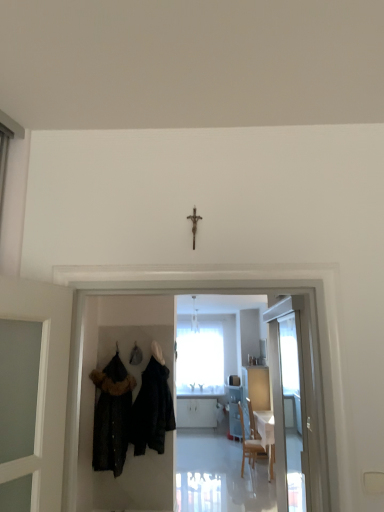
Question: Is white glossy door at right to the right of velvet black coat at left, arranged as the second fancy dress when viewed from the right, from the viewer's perspective?

Choices:
 (A) no
 (B) yes

Answer: (B)

Question: Does white glossy door at right have a smaller size compared to velvet black coat at left, which is counted as the 1th fancy dress, starting from the left?

Choices:
 (A) no
 (B) yes

Answer: (B)

Question: Is white glossy door at right located outside velvet black coat at left, which is counted as the 1th fancy dress, starting from the left?

Choices:
 (A) yes
 (B) no

Answer: (A)

Question: Is velvet black coat at left, arranged as the second fancy dress when viewed from the right, surrounded by white glossy door at right?

Choices:
 (A) yes
 (B) no

Answer: (B)

Question: Considering the relative sizes of white glossy door at right and velvet black coat at left, which is counted as the 1th fancy dress, starting from the left, in the image provided, is white glossy door at right shorter than velvet black coat at left, which is counted as the 1th fancy dress, starting from the left,?

Choices:
 (A) yes
 (B) no

Answer: (A)

Question: Is metallic crucifix at center to the left or to the right of velvet black coat at left, arranged as the second fancy dress when viewed from the right, in the image?

Choices:
 (A) right
 (B) left

Answer: (A)

Question: Do you think metallic crucifix at center is within velvet black coat at left, which is counted as the 1th fancy dress, starting from the left, or outside of it?

Choices:
 (A) inside
 (B) outside

Answer: (B)

Question: Considering the positions of metallic crucifix at center and velvet black coat at left, which is counted as the 1th fancy dress, starting from the left, in the image, is metallic crucifix at center wider or thinner than velvet black coat at left, which is counted as the 1th fancy dress, starting from the left,?

Choices:
 (A) wide
 (B) thin

Answer: (B)

Question: From the image's perspective, is metallic crucifix at center positioned above or below velvet black coat at left, arranged as the second fancy dress when viewed from the right?

Choices:
 (A) above
 (B) below

Answer: (A)

Question: Choose the correct answer: Is velvet black coat at left, which is counted as the 1th fancy dress, starting from the left, inside white glossy door at right or outside it?

Choices:
 (A) inside
 (B) outside

Answer: (B)

Question: Does point (107, 415) appear closer or farther from the camera than point (279, 372)?

Choices:
 (A) closer
 (B) farther

Answer: (A)

Question: From the image's perspective, relative to white glossy door at right, is velvet black coat at left, arranged as the second fancy dress when viewed from the right, above or below?

Choices:
 (A) below
 (B) above

Answer: (A)

Question: From their relative heights in the image, would you say velvet black coat at left, arranged as the second fancy dress when viewed from the right, is taller or shorter than white glossy door at right?

Choices:
 (A) short
 (B) tall

Answer: (B)

Question: In the image, is white glossy door at right positioned in front of or behind velvet black coat at left, which is counted as the 1th fancy dress, starting from the left?

Choices:
 (A) front
 (B) behind

Answer: (A)

Question: From the image's perspective, relative to velvet black coat at left, which is counted as the 1th fancy dress, starting from the left, is white glossy door at right above or below?

Choices:
 (A) below
 (B) above

Answer: (B)